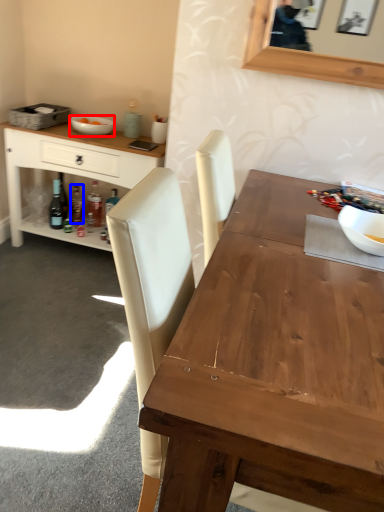
Question: Among these objects, which one is farthest to the camera, bowl (highlighted by a red box) or bottle (highlighted by a blue box)?

Choices:
 (A) bowl
 (B) bottle

Answer: (B)